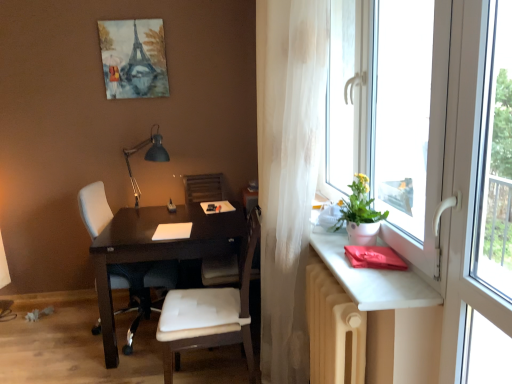
Question: Is beige radiator at lower right not close to wooden armchair at center?

Choices:
 (A) no
 (B) yes

Answer: (B)

Question: From a real-world perspective, is beige radiator at lower right positioned over wooden armchair at center based on gravity?

Choices:
 (A) yes
 (B) no

Answer: (B)

Question: Does beige radiator at lower right contain wooden armchair at center?

Choices:
 (A) no
 (B) yes

Answer: (A)

Question: Considering the relative sizes of beige radiator at lower right and wooden armchair at center in the image provided, is beige radiator at lower right wider than wooden armchair at center?

Choices:
 (A) no
 (B) yes

Answer: (A)

Question: Is beige radiator at lower right turned away from wooden armchair at center?

Choices:
 (A) no
 (B) yes

Answer: (A)

Question: Is white leather chair at center, the 2th chair viewed from the right, wider or thinner than matte white table at right?

Choices:
 (A) thin
 (B) wide

Answer: (B)

Question: Looking at the image, does white leather chair at center, marked as the first chair in a back-to-front arrangement, seem bigger or smaller compared to matte white table at right?

Choices:
 (A) small
 (B) big

Answer: (B)

Question: Would you say white leather chair at center, which appears as the 1th chair when viewed from the left, is to the left or to the right of matte white table at right in the picture?

Choices:
 (A) right
 (B) left

Answer: (B)

Question: Considering the positions of white leather chair at center, the 2th chair viewed from the right, and matte white table at right in the image, is white leather chair at center, the 2th chair viewed from the right, taller or shorter than matte white table at right?

Choices:
 (A) tall
 (B) short

Answer: (A)

Question: Is white matte pot at window inside the boundaries of matte white table at right, or outside?

Choices:
 (A) inside
 (B) outside

Answer: (B)

Question: Considering their positions, is white matte pot at window located in front of or behind matte white table at right?

Choices:
 (A) front
 (B) behind

Answer: (B)

Question: From their relative heights in the image, would you say white matte pot at window is taller or shorter than matte white table at right?

Choices:
 (A) tall
 (B) short

Answer: (A)

Question: From the image's perspective, is white matte pot at window above or below matte white table at right?

Choices:
 (A) above
 (B) below

Answer: (A)

Question: Is white leather chair at center, which appears as the first chair when viewed from the right, wider or thinner than translucent white curtain at right?

Choices:
 (A) wide
 (B) thin

Answer: (A)

Question: Considering the relative positions of white leather chair at center, the first chair from the front, and translucent white curtain at right in the image provided, is white leather chair at center, the first chair from the front, to the left or to the right of translucent white curtain at right?

Choices:
 (A) right
 (B) left

Answer: (B)